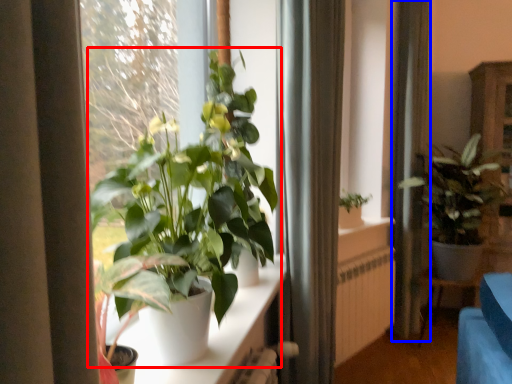
Question: Which point is closer to the camera, houseplant (highlighted by a red box) or curtain (highlighted by a blue box)?

Choices:
 (A) houseplant
 (B) curtain

Answer: (A)